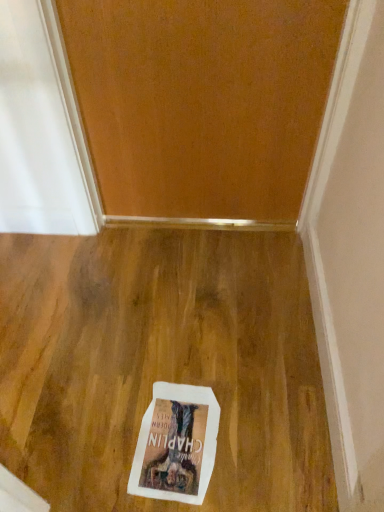
You are a GUI agent. You are given a task and a screenshot of the screen. Output one action in this format:
    pyautogui.click(x=<x>, y=<y>)
    Task: Click on the white paper postcard at center
    
    Given the screenshot: What is the action you would take?
    pyautogui.click(x=176, y=444)

This screenshot has height=512, width=384. What do you see at coordinates (176, 444) in the screenshot?
I see `white paper postcard at center` at bounding box center [176, 444].

Find the location of `wooden door at upper center`. wooden door at upper center is located at coordinates (202, 101).

What do you see at coordinates (202, 101) in the screenshot? I see `wooden door at upper center` at bounding box center [202, 101].

I want to click on white paper postcard at center, so click(176, 444).

Considering the positions of objects wooden door at upper center and white paper postcard at center in the image provided, who is more to the left, wooden door at upper center or white paper postcard at center?

white paper postcard at center is more to the left.

Which object is closer to the camera taking this photo, wooden door at upper center or white paper postcard at center?

wooden door at upper center.

Which is behind, point (101, 60) or point (134, 465)?

The point (101, 60) is more distant.

From the image's perspective, which is below, wooden door at upper center or white paper postcard at center?

white paper postcard at center appears lower in the image.

From a real-world perspective, is wooden door at upper center under white paper postcard at center?

Incorrect, from a real-world perspective, wooden door at upper center is higher than white paper postcard at center.

In terms of width, does wooden door at upper center look wider or thinner when compared to white paper postcard at center?

Considering their sizes, wooden door at upper center looks slimmer than white paper postcard at center.

Considering the sizes of wooden door at upper center and white paper postcard at center in the image, is wooden door at upper center taller or shorter than white paper postcard at center?

In the image, wooden door at upper center appears to be taller than white paper postcard at center.

Between wooden door at upper center and white paper postcard at center, which one has smaller size?

white paper postcard at center.

Which is correct: wooden door at upper center is inside white paper postcard at center, or outside of it?

wooden door at upper center is outside white paper postcard at center.

Is wooden door at upper center with white paper postcard at center?

wooden door at upper center and white paper postcard at center are not in contact.

Could you tell me if wooden door at upper center is turned towards white paper postcard at center?

Yes, wooden door at upper center is turned towards white paper postcard at center.

Find the location of a particular element. postcard located on the left of wooden door at upper center is located at coordinates (176, 444).

Which object is positioned more to the left, white paper postcard at center or wooden door at upper center?

From the viewer's perspective, white paper postcard at center appears more on the left side.

Which object is more forward, white paper postcard at center or wooden door at upper center?

Positioned in front is wooden door at upper center.

Which is in front, point (183, 417) or point (211, 104)?

The point (183, 417) is closer.

From the image's perspective, between white paper postcard at center and wooden door at upper center, which one is located above?

wooden door at upper center appears higher in the image.

From a real-world perspective, is white paper postcard at center physically located above or below wooden door at upper center?

white paper postcard at center is below wooden door at upper center.

Is white paper postcard at center wider than wooden door at upper center?

Indeed, white paper postcard at center has a greater width compared to wooden door at upper center.

Between white paper postcard at center and wooden door at upper center, which one has less height?

Standing shorter between the two is white paper postcard at center.

Can you confirm if white paper postcard at center is smaller than wooden door at upper center?

Yes, white paper postcard at center is smaller than wooden door at upper center.

From the picture: Is wooden door at upper center surrounded by white paper postcard at center?

Actually, wooden door at upper center is outside white paper postcard at center.

Is white paper postcard at center next to wooden door at upper center?

No, white paper postcard at center is not touching wooden door at upper center.

Is white paper postcard at center aimed at wooden door at upper center?

No, white paper postcard at center is not oriented towards wooden door at upper center.

How many degrees apart are the facing directions of white paper postcard at center and wooden door at upper center?

The angular difference between white paper postcard at center and wooden door at upper center is 89.2 degrees.

Identify the location of door that appears on the right of white paper postcard at center. The image size is (384, 512). (202, 101).

Image resolution: width=384 pixels, height=512 pixels. There is a white paper postcard at center. Identify the location of door above it (from a real-world perspective). (202, 101).

What are the coordinates of `door above the white paper postcard at center (from the image's perspective)` in the screenshot? It's located at (202, 101).